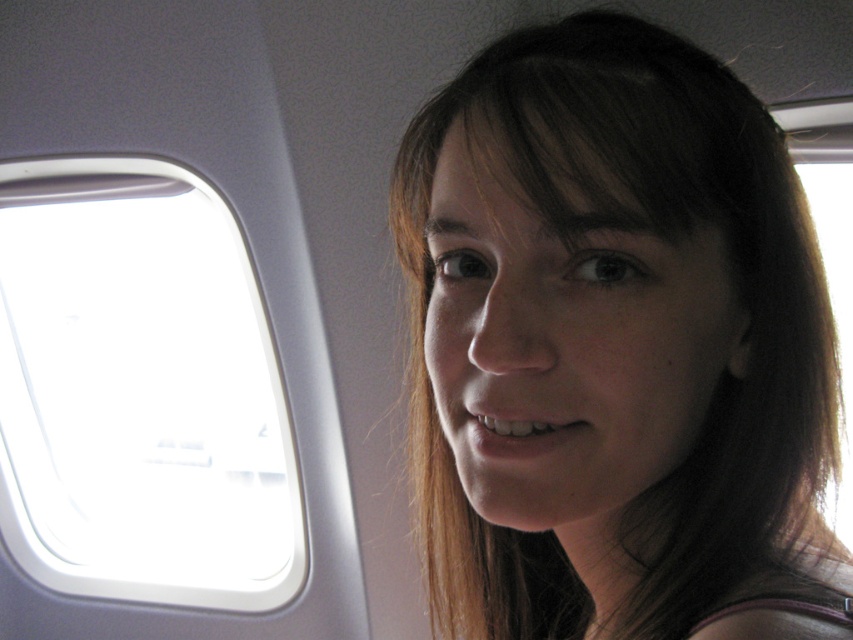
Question: Which object appears farthest from the camera in this image?

Choices:
 (A) brown hair at upper center
 (B) transparent glass airplane window at upper left

Answer: (B)

Question: Can you confirm if brown hair at upper center is positioned below transparent glass airplane window at upper left?

Choices:
 (A) yes
 (B) no

Answer: (B)

Question: Which of the following is the farthest from the observer?

Choices:
 (A) (538, 536)
 (B) (155, 548)

Answer: (B)

Question: Which of the following is the closest to the observer?

Choices:
 (A) transparent glass airplane window at upper left
 (B) brown hair at upper center

Answer: (B)

Question: Does brown hair at upper center appear on the right side of transparent glass airplane window at upper left?

Choices:
 (A) no
 (B) yes

Answer: (B)

Question: Does brown hair at upper center come in front of transparent glass airplane window at upper left?

Choices:
 (A) no
 (B) yes

Answer: (B)